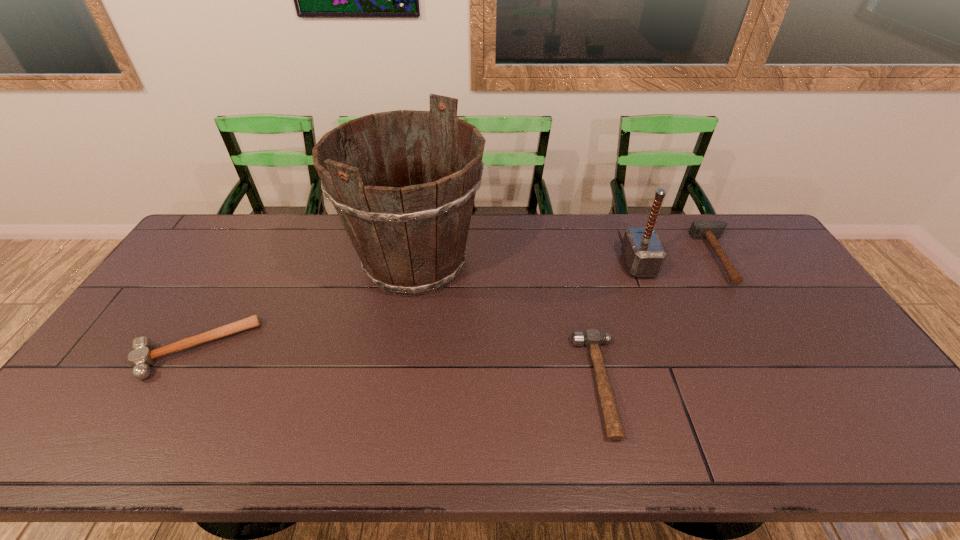
Locate an element on the screen. The image size is (960, 540). object located at the right edge is located at coordinates (711, 230).

The image size is (960, 540). What are the coordinates of `object present at the far right corner` in the screenshot? It's located at (711, 230).

I want to click on free space at the far edge, so click(x=672, y=227).

At what (x,y) coordinates should I click in order to perform the action: click on free space at the near edge of the desktop. Please return your answer as a coordinate pair (x, y). The height and width of the screenshot is (540, 960). Looking at the image, I should click on pyautogui.click(x=804, y=458).

Find the location of a particular element. This screenshot has height=540, width=960. vacant position at the right edge of the desktop is located at coordinates (839, 363).

In the image, there is a desktop. Where is `vacant area at the far left corner`? Image resolution: width=960 pixels, height=540 pixels. vacant area at the far left corner is located at coordinates (208, 221).

In the image, there is a desktop. Where is `free space at the far right corner`? free space at the far right corner is located at coordinates (751, 245).

This screenshot has width=960, height=540. In order to click on vacant point located between the tallest object and the fourth shortest object in this screenshot , I will do `click(527, 264)`.

At what (x,y) coordinates should I click in order to perform the action: click on blank region between the second tallest hammer and the leftmost object. Please return your answer as a coordinate pair (x, y). Looking at the image, I should click on (457, 303).

This screenshot has height=540, width=960. I want to click on free space between the third hammer from right to left and the tallest object, so click(x=508, y=323).